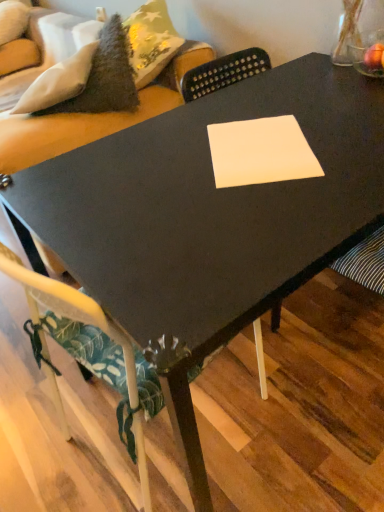
Question: Does white paper at center have a greater width compared to velvet green couch at upper left?

Choices:
 (A) yes
 (B) no

Answer: (B)

Question: Is white paper at center positioned before velvet green couch at upper left?

Choices:
 (A) no
 (B) yes

Answer: (B)

Question: From a real-world perspective, does white paper at center sit lower than velvet green couch at upper left?

Choices:
 (A) yes
 (B) no

Answer: (B)

Question: Would you consider white paper at center to be distant from velvet green couch at upper left?

Choices:
 (A) no
 (B) yes

Answer: (A)

Question: Is white paper at center to the right of velvet green couch at upper left from the viewer's perspective?

Choices:
 (A) no
 (B) yes

Answer: (B)

Question: Is velvet green couch at upper left spatially inside white paper at center, or outside of it?

Choices:
 (A) inside
 (B) outside

Answer: (B)

Question: Looking at the image, does velvet green couch at upper left seem bigger or smaller compared to white paper at center?

Choices:
 (A) small
 (B) big

Answer: (B)

Question: Considering the relative positions of velvet green couch at upper left and white paper at center in the image provided, is velvet green couch at upper left to the left or to the right of white paper at center?

Choices:
 (A) right
 (B) left

Answer: (B)

Question: Is velvet green couch at upper left in front of or behind white paper at center in the image?

Choices:
 (A) behind
 (B) front

Answer: (A)

Question: In terms of width, does white fabric chair at lower left look wider or thinner when compared to white paper at center?

Choices:
 (A) wide
 (B) thin

Answer: (A)

Question: From a real-world perspective, is white fabric chair at lower left positioned above or below white paper at center?

Choices:
 (A) above
 (B) below

Answer: (B)

Question: In the image, is white fabric chair at lower left on the left side or the right side of white paper at center?

Choices:
 (A) left
 (B) right

Answer: (A)

Question: Considering the positions of white fabric chair at lower left and white paper at center in the image, is white fabric chair at lower left taller or shorter than white paper at center?

Choices:
 (A) tall
 (B) short

Answer: (A)

Question: From a real-world perspective, is velvet green couch at upper left physically located above or below white fabric chair at lower left?

Choices:
 (A) above
 (B) below

Answer: (A)

Question: In terms of width, does velvet green couch at upper left look wider or thinner when compared to white fabric chair at lower left?

Choices:
 (A) wide
 (B) thin

Answer: (A)